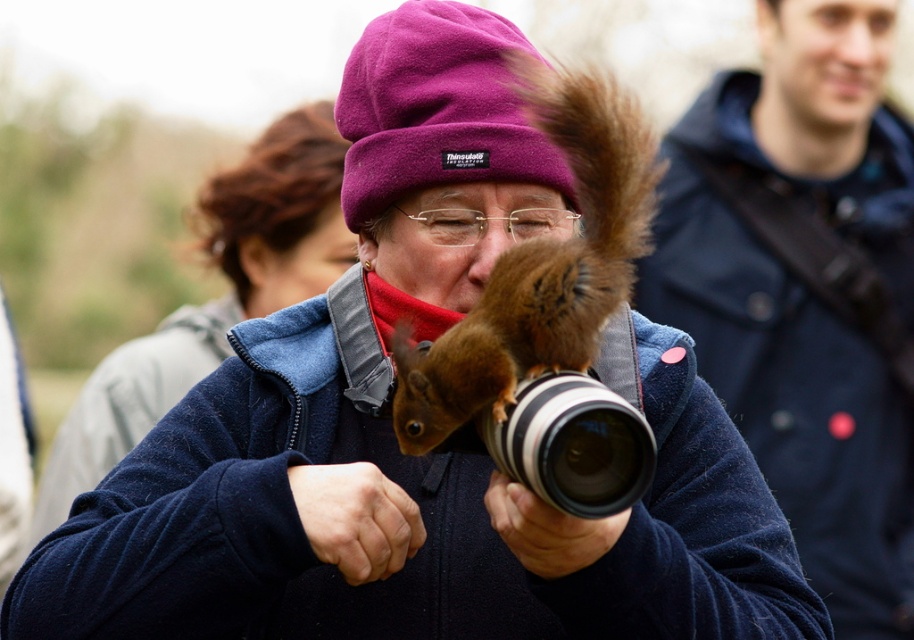
Question: Which is farther from the purple fleece beanie at center?

Choices:
 (A) velvet blue jacket at center
 (B) black rubber camera grip at center

Answer: (A)

Question: Which of the following is the closest to the observer?

Choices:
 (A) (511, 157)
 (B) (537, 506)
 (C) (545, 77)

Answer: (B)

Question: Does velvet blue jacket at center have a greater width compared to smooth skin hand at center?

Choices:
 (A) yes
 (B) no

Answer: (A)

Question: Where is purple fleece beanie at center located in relation to matte black camera at center in the image?

Choices:
 (A) left
 (B) right

Answer: (A)

Question: Can you confirm if dark blue jacket at upper right is positioned above black rubber camera grip at center?

Choices:
 (A) no
 (B) yes

Answer: (B)

Question: Among these objects, which one is farthest from the camera?

Choices:
 (A) smooth skin hand at center
 (B) matte black camera at center

Answer: (A)